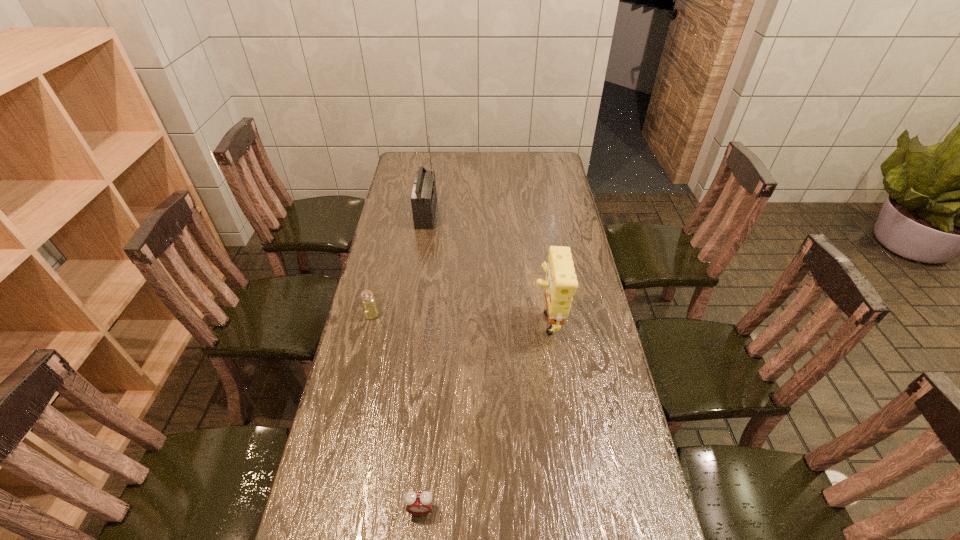
At what (x,y) coordinates should I click in order to perform the action: click on vacant point located on the face of the rightmost object. Please return your answer as a coordinate pair (x, y). The width and height of the screenshot is (960, 540). Looking at the image, I should click on (453, 318).

This screenshot has width=960, height=540. What are the coordinates of `vacant space located on the front of the saltshaker` in the screenshot? It's located at (366, 342).

This screenshot has height=540, width=960. I want to click on radio receiver at the left edge, so click(x=424, y=197).

At what (x,y) coordinates should I click in order to perform the action: click on saltshaker positioned at the left edge. Please return your answer as a coordinate pair (x, y). The image size is (960, 540). Looking at the image, I should click on (370, 309).

Where is `object situated at the right edge`? The height and width of the screenshot is (540, 960). object situated at the right edge is located at coordinates (560, 283).

Where is `free location at the far edge`? free location at the far edge is located at coordinates (507, 152).

You are a GUI agent. You are given a task and a screenshot of the screen. Output one action in this format:
    pyautogui.click(x=<x>, y=<y>)
    Task: Click on the vacant region at the left edge of the desktop
    
    Given the screenshot: What is the action you would take?
    pyautogui.click(x=386, y=285)

The width and height of the screenshot is (960, 540). What are the coordinates of `free space at the right edge` in the screenshot? It's located at (559, 212).

Find the location of `vacant space at the far right corner of the desktop`. vacant space at the far right corner of the desktop is located at coordinates (552, 157).

Locate an element on the screen. The height and width of the screenshot is (540, 960). vacant area that lies between the radio receiver and the nearest object is located at coordinates (423, 362).